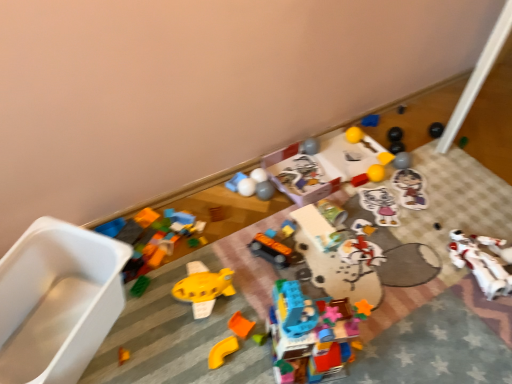
The image size is (512, 384). I want to click on vacant area that is in front of matte plastic sticker at center, positioned as the 16th toy in left-to-right order, so click(x=418, y=228).